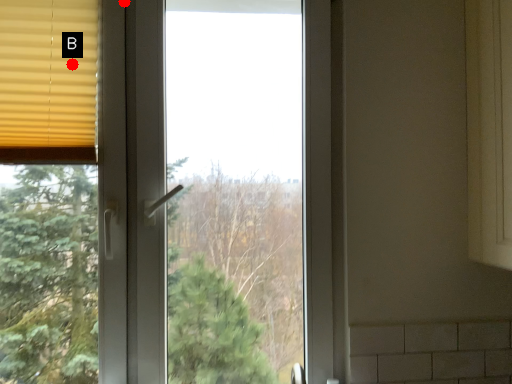
Question: Two points are circled on the image, labeled by A and B beside each circle. Which point is closer to the camera?

Choices:
 (A) A is closer
 (B) B is closer

Answer: (B)